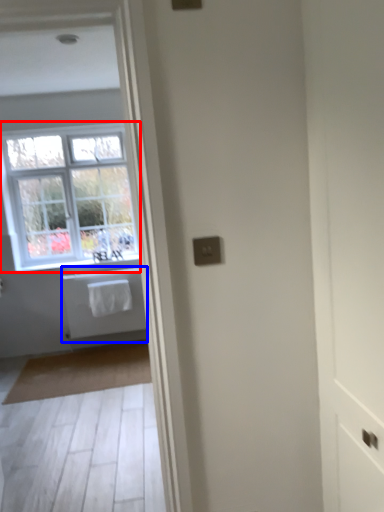
Question: Which point is closer to the camera, window (highlighted by a red box) or bath (highlighted by a blue box)?

Choices:
 (A) window
 (B) bath

Answer: (A)